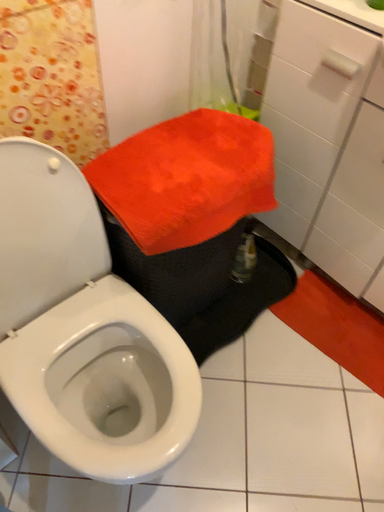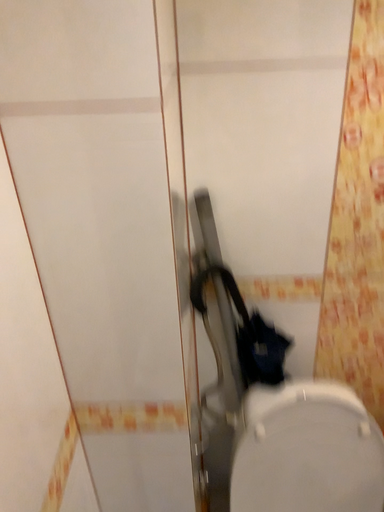
Question: Which way did the camera rotate in the video?

Choices:
 (A) rotated downward
 (B) rotated upward

Answer: (B)